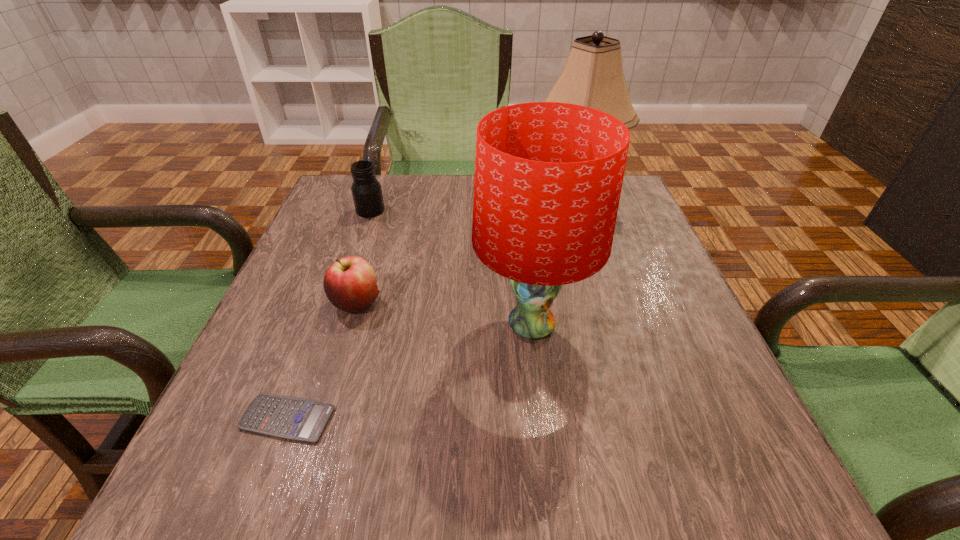
Locate an element on the screen. The image size is (960, 540). lamp is located at coordinates (592, 76).

Locate an element on the screen. This screenshot has width=960, height=540. lampshade is located at coordinates (548, 176).

In order to click on jar in this screenshot , I will do 366,190.

Locate an element on the screen. Image resolution: width=960 pixels, height=540 pixels. the fourth tallest object is located at coordinates (349, 283).

Identify the location of calculator. The width and height of the screenshot is (960, 540). (291, 418).

The image size is (960, 540). Find the location of `the nearest object`. the nearest object is located at coordinates (291, 418).

The height and width of the screenshot is (540, 960). Identify the location of vacant space situated on the front of the lamp. (593, 275).

Image resolution: width=960 pixels, height=540 pixels. I want to click on vacant space located 0.130m on the front-facing side of the lampshade, so click(404, 325).

Identify the location of vacant space located 0.350m on the front-facing side of the lampshade. This screenshot has height=540, width=960. (289, 325).

Where is `vacant space located on the front-facing side of the lampshade`? The height and width of the screenshot is (540, 960). vacant space located on the front-facing side of the lampshade is located at coordinates (372, 325).